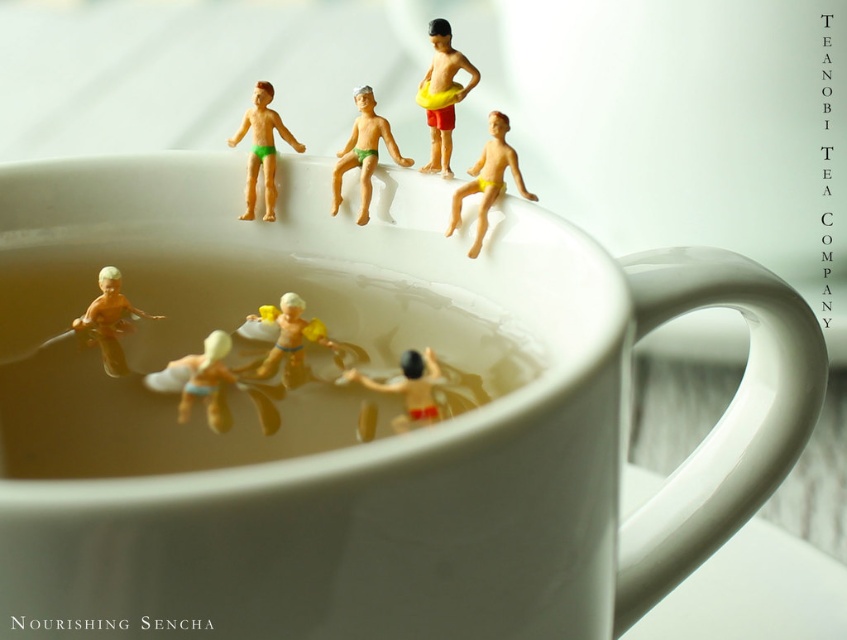
Question: Which of the following is the closest to the observer?

Choices:
 (A) matte yellow plastic surfboard at lower center
 (B) yellow matte toy at center
 (C) yellow rubber ring at upper center

Answer: (A)

Question: Does yellow rubber ring at upper center lie in front of green matte toy at upper center?

Choices:
 (A) no
 (B) yes

Answer: (B)

Question: Does brown matte coffee at lower center appear on the right side of green matte plastic toy at upper left?

Choices:
 (A) no
 (B) yes

Answer: (A)

Question: Considering the real-world distances, which object is closest to the matte yellow toy at upper center?

Choices:
 (A) white glossy mug at upper center
 (B) green matte toy at upper center
 (C) matte yellow plastic surfboard at lower center
 (D) yellow matte toy at upper right

Answer: (C)

Question: Does yellow rubber ring at upper center lie in front of matte yellow plastic boy at lower left?

Choices:
 (A) yes
 (B) no

Answer: (B)

Question: Which object is positioned closest to the matte yellow toy at upper center?

Choices:
 (A) yellow matte toy at center
 (B) green matte plastic toy at upper left
 (C) matte yellow plastic boy at lower left
 (D) yellow matte toy at upper right

Answer: (A)